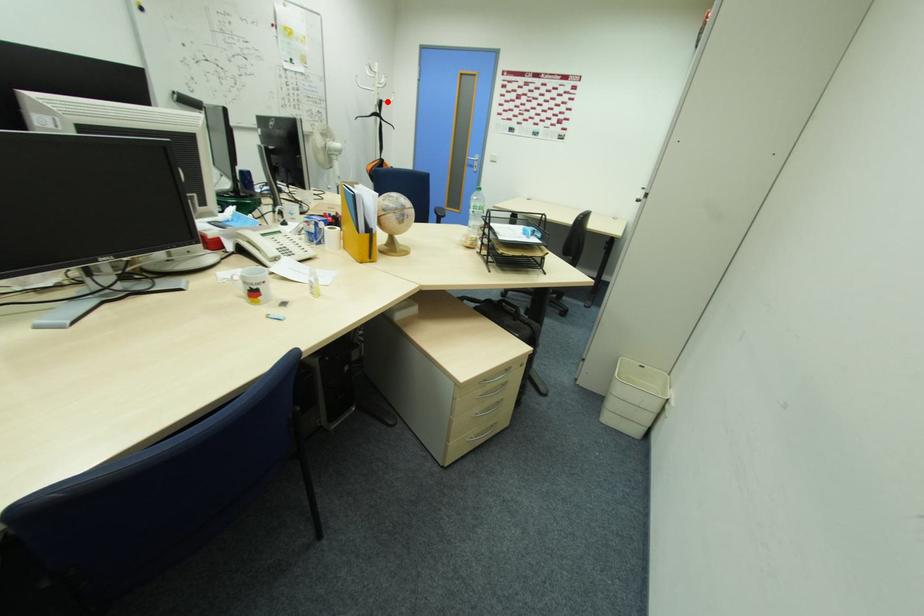
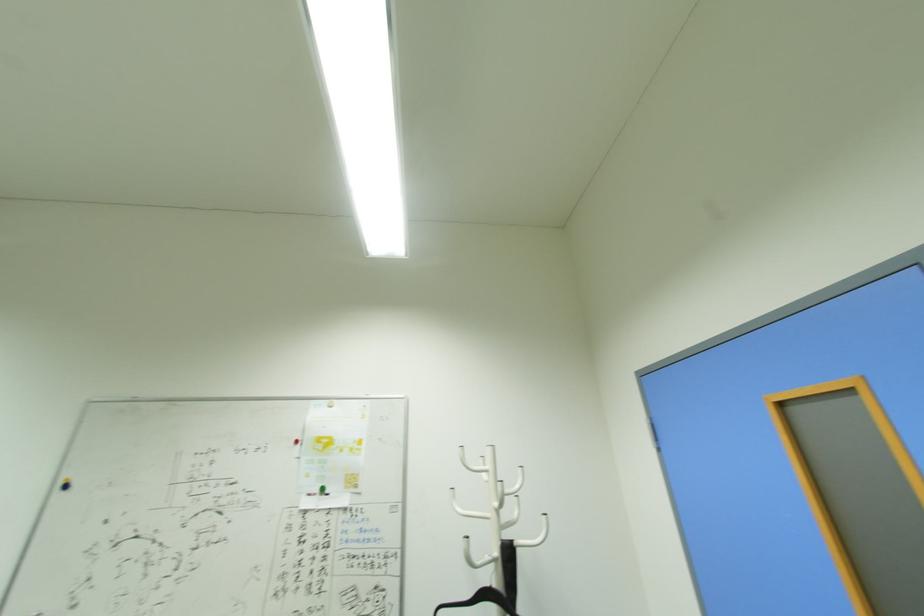
Locate, in the second image, the point that corresponds to the highlighted location in the first image.

(518, 544)